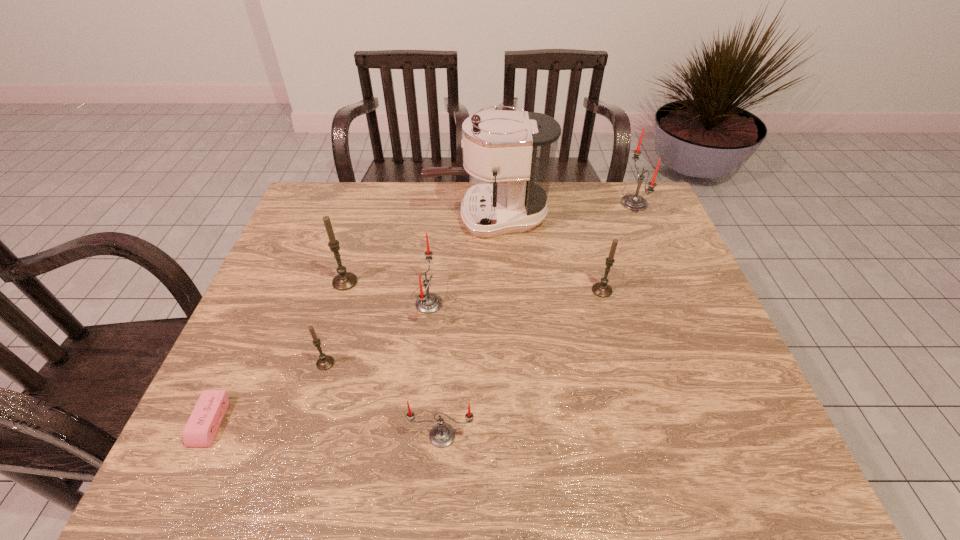
This screenshot has width=960, height=540. I want to click on coffee maker, so click(518, 147).

Where is `the tallest object`? The width and height of the screenshot is (960, 540). the tallest object is located at coordinates (518, 147).

You are a GUI agent. You are given a task and a screenshot of the screen. Output one action in this format:
    pyautogui.click(x=<x>, y=<y>)
    Task: Click on the rightmost object
    The image size is (960, 540).
    Given the screenshot: What is the action you would take?
    pyautogui.click(x=632, y=202)

This screenshot has width=960, height=540. I want to click on the farthest candle, so click(632, 202).

This screenshot has width=960, height=540. Identify the location of the biggest gray candle. (344, 280).

Locate an element on the screen. the second biggest gray candle is located at coordinates (601, 289).

The height and width of the screenshot is (540, 960). What are the coordinates of `the second object from right to left` in the screenshot? It's located at (601, 289).

The height and width of the screenshot is (540, 960). I want to click on the second nearest red candle, so click(426, 302).

This screenshot has width=960, height=540. What are the coordinates of `the nearest gray candle` in the screenshot? It's located at (325, 362).

At what (x,y) coordinates should I click in order to perform the action: click on the second nearest candle. Please return your answer as a coordinate pair (x, y). This screenshot has width=960, height=540. Looking at the image, I should click on pos(325,362).